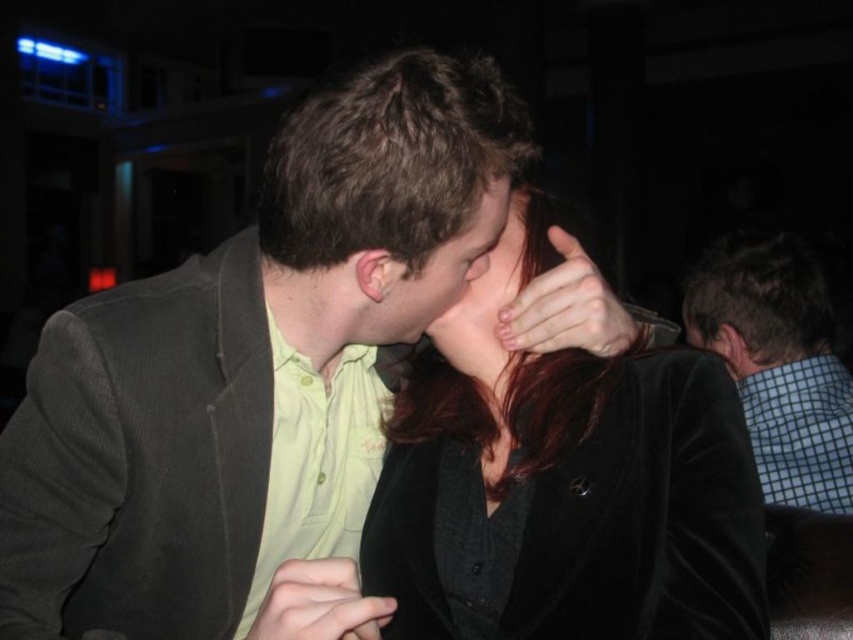
Question: Does matte black hand at center have a smaller size compared to matte skin nose at center?

Choices:
 (A) yes
 (B) no

Answer: (B)

Question: Which object is closer to the camera taking this photo?

Choices:
 (A) matte black hair at center
 (B) velvet black jacket at center

Answer: (B)

Question: Among these objects, which one is nearest to the camera?

Choices:
 (A) matte black hair at center
 (B) matte yellow shirt at center

Answer: (B)

Question: Is matte gray suit at center to the left of matte black hair at center from the viewer's perspective?

Choices:
 (A) no
 (B) yes

Answer: (B)

Question: Which of these objects is positioned farthest from the velvet black jacket at center?

Choices:
 (A) matte black hair at center
 (B) matte yellow shirt at center
 (C) matte gray suit at center
 (D) blue checkered shirt at right

Answer: (D)

Question: Does blue checkered shirt at right have a lesser width compared to matte black hand at center?

Choices:
 (A) yes
 (B) no

Answer: (B)